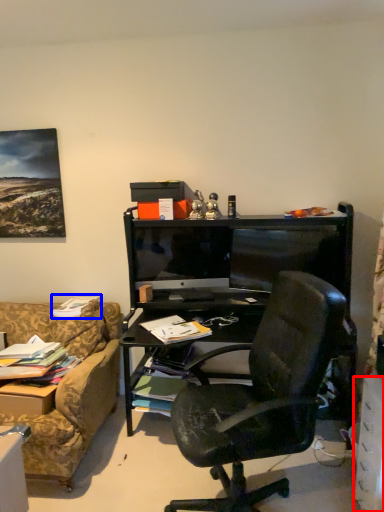
Question: Which object appears closest to the camera in this image, drawer (highlighted by a red box) or book (highlighted by a blue box)?

Choices:
 (A) drawer
 (B) book

Answer: (A)